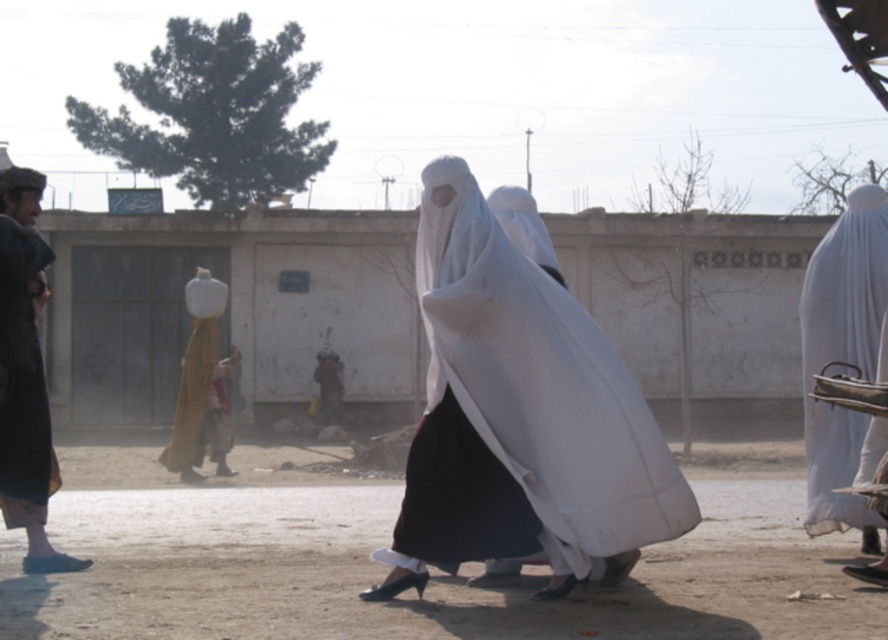
You are a fashion designer observing the outdoor scene. You need to decide which garment to recommend for a client who prefers shorter attire. Based on the image, which of the two garments, the white matte burqa at right or the dark brown leather jacket at left, is shorter?

The white matte burqa at right is shorter than the dark brown leather jacket at left, so the white matte burqa at right would be the better recommendation for shorter attire.

Looking at this image, you are a photographer setting up a tripod in the dirt field at lower center. You want to place the dark brown leather jacket at left on the tripod. Can the tripod hold the jacket?

The dirt field at lower center is bigger than the dark brown leather jacket at left, but the jacket can still be placed on the tripod as size comparison does not affect the tripod capacity unless specified.